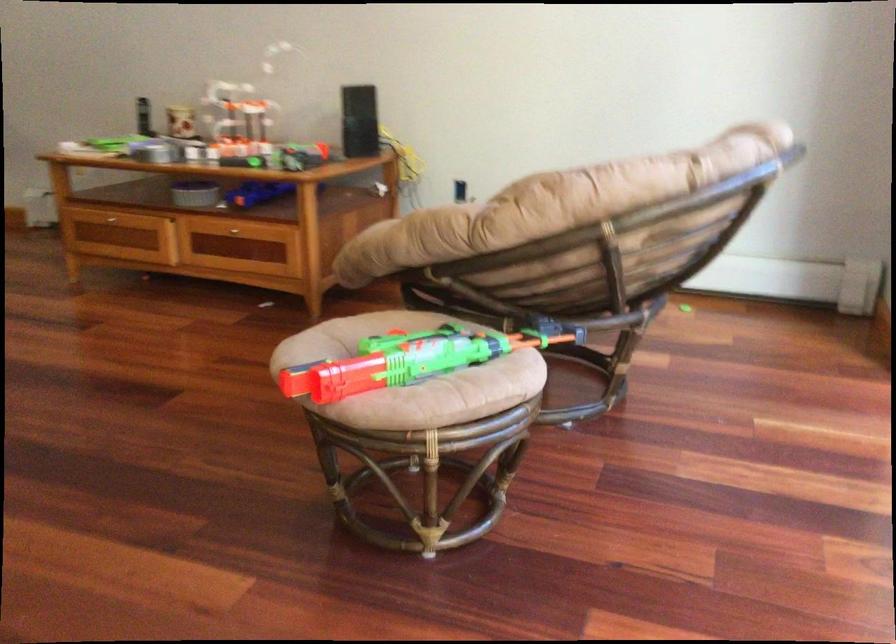
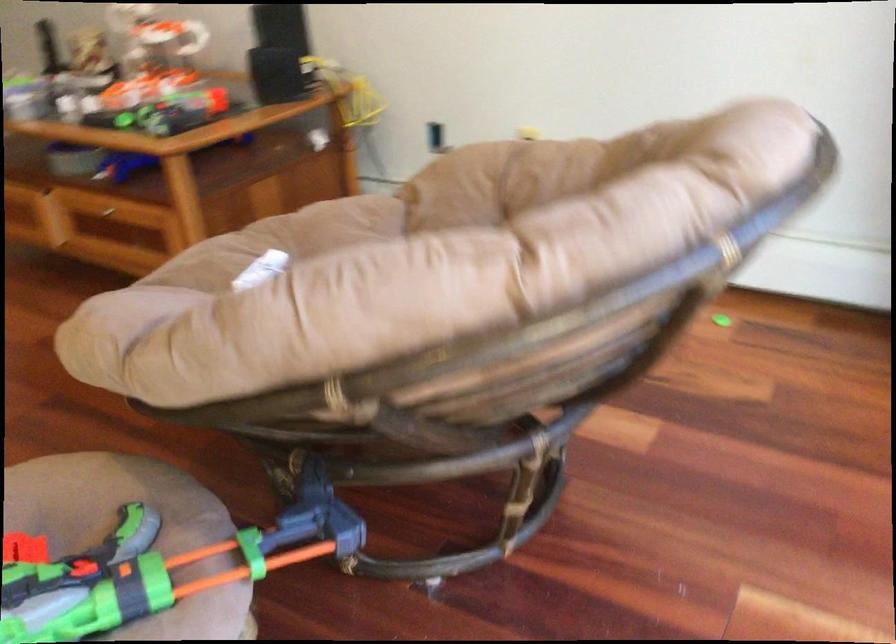
In the second image, find the point that corresponds to pixel 472 328 in the first image.

(133, 532)